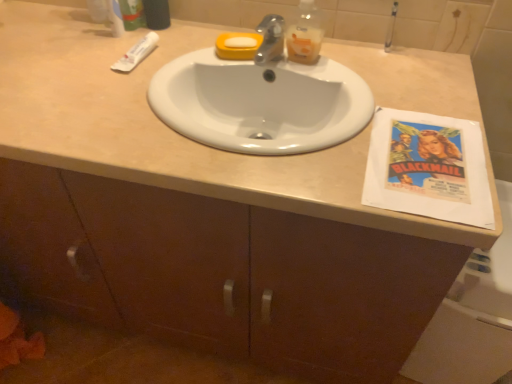
Find the location of a particular element. blank space to the left of green matte toothpaste tube at upper left is located at coordinates (63, 30).